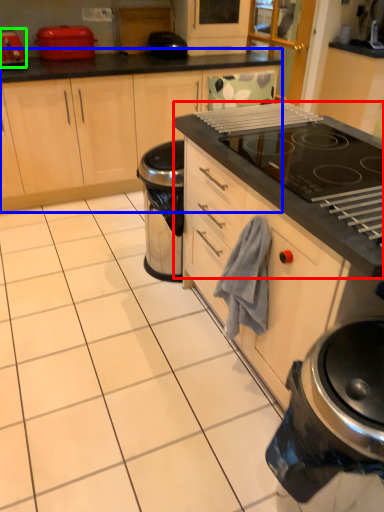
Question: Which object is the closest to the oven (highlighted by a red box)? Choose among these: cabinetry (highlighted by a blue box) or kitchen appliance (highlighted by a green box).

Choices:
 (A) cabinetry
 (B) kitchen appliance

Answer: (A)